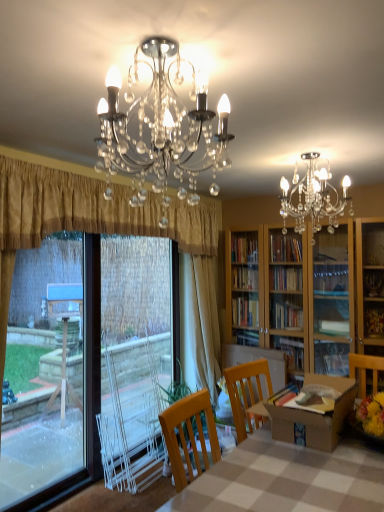
Question: Does white plastic screen door at left have a greater width compared to checkerboard fabric table at center?

Choices:
 (A) yes
 (B) no

Answer: (B)

Question: Is checkerboard fabric table at center at the back of white plastic screen door at left?

Choices:
 (A) no
 (B) yes

Answer: (A)

Question: Does white plastic screen door at left have a smaller size compared to checkerboard fabric table at center?

Choices:
 (A) yes
 (B) no

Answer: (A)

Question: Is white plastic screen door at left located outside checkerboard fabric table at center?

Choices:
 (A) no
 (B) yes

Answer: (B)

Question: From a real-world perspective, is white plastic screen door at left physically below checkerboard fabric table at center?

Choices:
 (A) yes
 (B) no

Answer: (B)

Question: In terms of height, does transparent plastic window screen at left look taller or shorter compared to clear crystal chandelier at upper center?

Choices:
 (A) tall
 (B) short

Answer: (A)

Question: Based on their sizes in the image, would you say transparent plastic window screen at left is bigger or smaller than clear crystal chandelier at upper center?

Choices:
 (A) small
 (B) big

Answer: (B)

Question: In the image, is transparent plastic window screen at left on the left side or the right side of clear crystal chandelier at upper center?

Choices:
 (A) right
 (B) left

Answer: (B)

Question: From the image's perspective, is transparent plastic window screen at left above or below clear crystal chandelier at upper center?

Choices:
 (A) above
 (B) below

Answer: (B)

Question: From a real-world perspective, relative to clear crystal chandelier at upper center, is brown cardboard box at center vertically above or below?

Choices:
 (A) below
 (B) above

Answer: (A)

Question: In terms of width, does brown cardboard box at center look wider or thinner when compared to clear crystal chandelier at upper center?

Choices:
 (A) thin
 (B) wide

Answer: (B)

Question: From the image's perspective, relative to clear crystal chandelier at upper center, is brown cardboard box at center above or below?

Choices:
 (A) below
 (B) above

Answer: (A)

Question: Considering the positions of brown cardboard box at center and clear crystal chandelier at upper center in the image, is brown cardboard box at center taller or shorter than clear crystal chandelier at upper center?

Choices:
 (A) tall
 (B) short

Answer: (B)

Question: Is transparent plastic window screen at left inside or outside of beige fabric curtain at center, the second curtain when ordered from front to back?

Choices:
 (A) outside
 (B) inside

Answer: (A)

Question: Considering the positions of transparent plastic window screen at left and beige fabric curtain at center, the second curtain when ordered from front to back, in the image, is transparent plastic window screen at left taller or shorter than beige fabric curtain at center, the second curtain when ordered from front to back,?

Choices:
 (A) short
 (B) tall

Answer: (A)